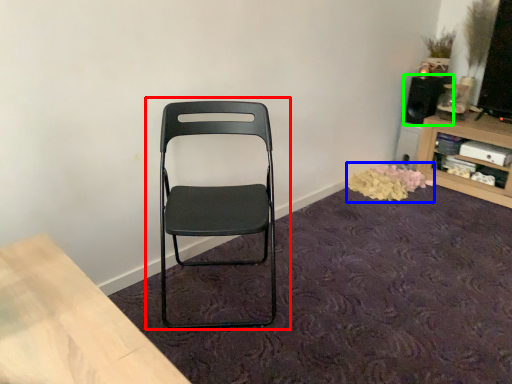
Question: Which object is positioned closest to chair (highlighted by a red box)? Select from flower (highlighted by a blue box) and speaker (highlighted by a green box).

Choices:
 (A) flower
 (B) speaker

Answer: (A)